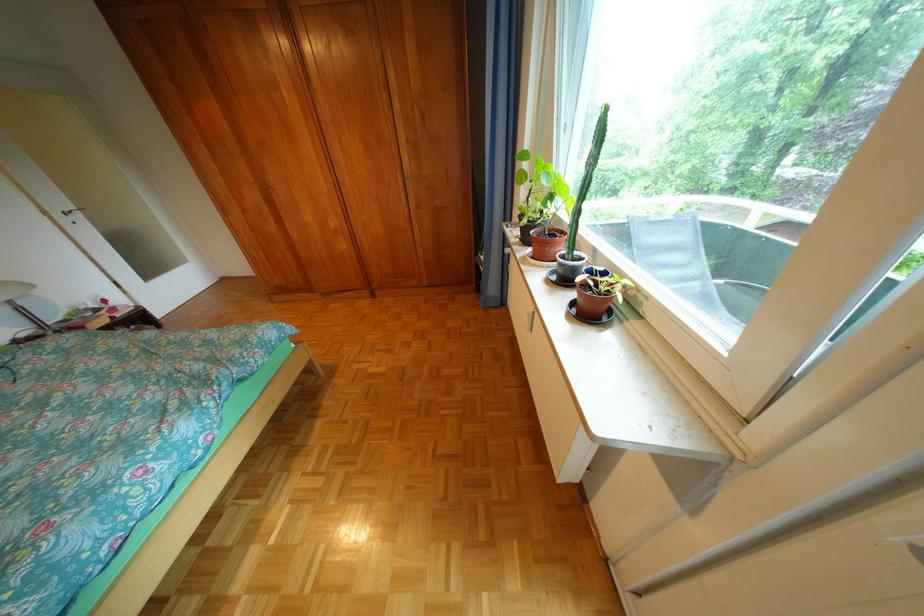
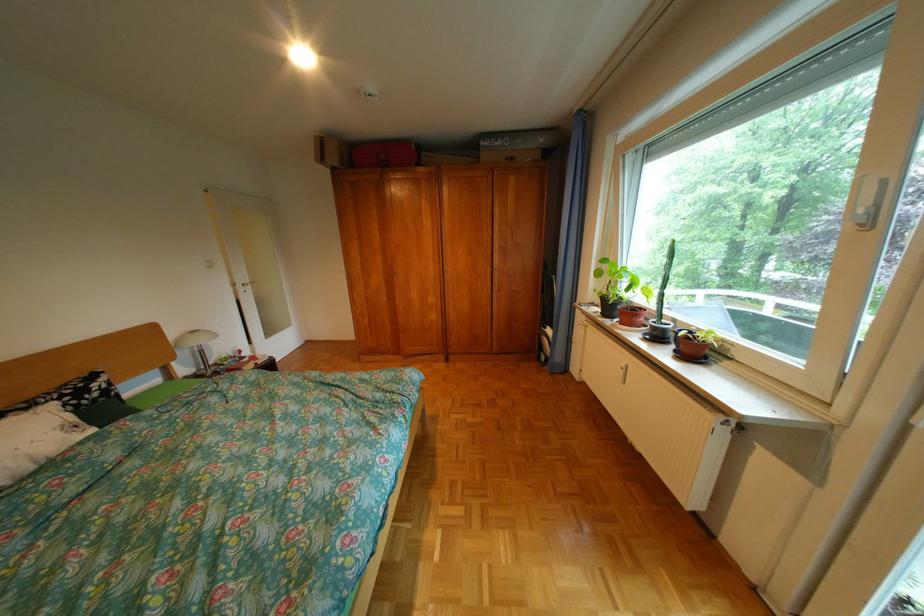
The point at (x=268, y=198) is marked in the first image. Where is the corresponding point in the second image?

(392, 280)